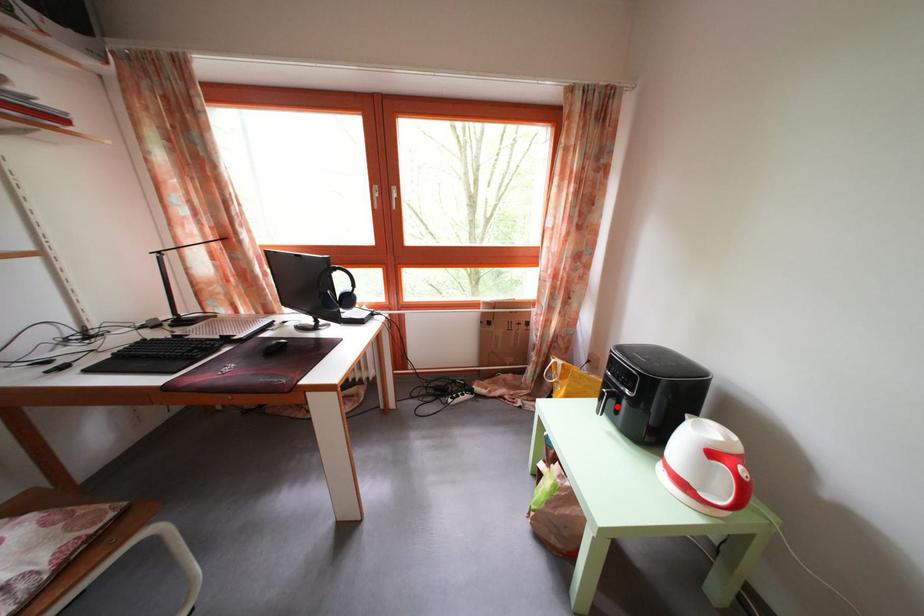
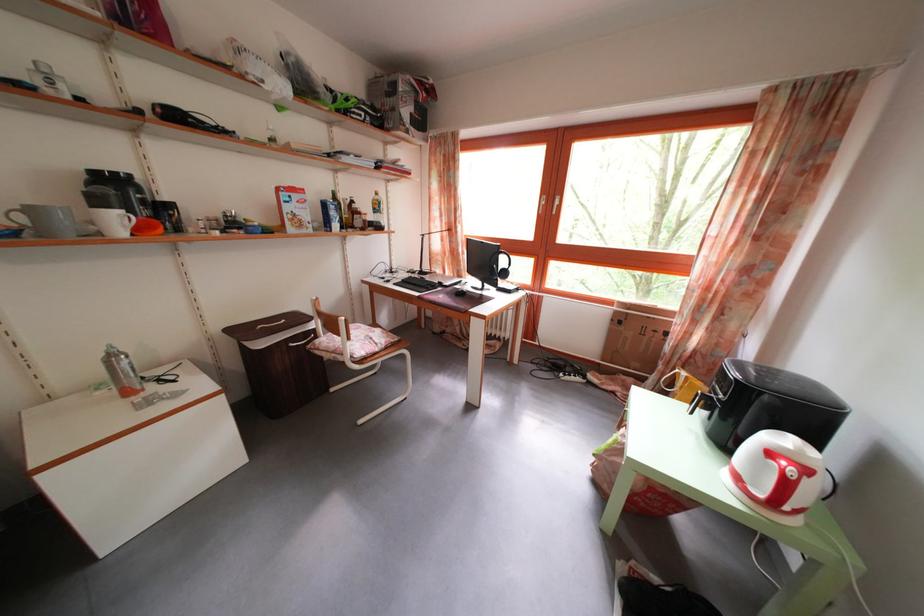
In the second image, find the point that corresponds to the highlighted location in the first image.

(713, 411)